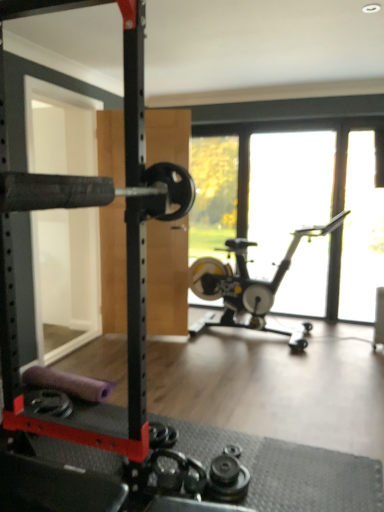
I want to click on vacant space in front of silver metallic stationary bicycle at center, so click(278, 388).